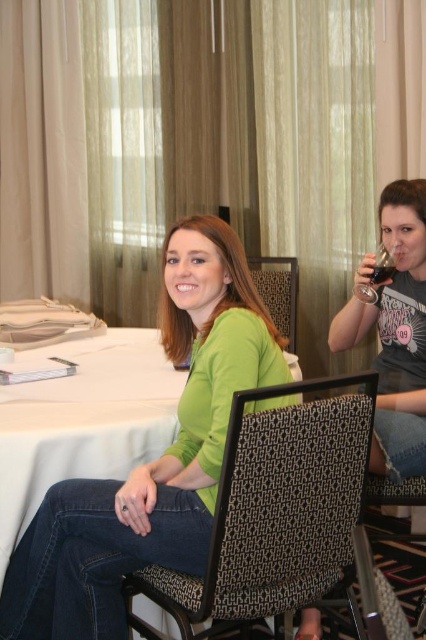
Question: Is brown textured fabric chair at center below translucent glass at upper right?

Choices:
 (A) yes
 (B) no

Answer: (A)

Question: Which object is the closest to the translucent glass at upper right?

Choices:
 (A) translucent glass wine glass at upper right
 (B) white fabric table at center

Answer: (A)

Question: Is black textured chair at center wider than translucent glass at upper right?

Choices:
 (A) yes
 (B) no

Answer: (A)

Question: Which point is farther from the camera taking this photo?

Choices:
 (A) (333, 321)
 (B) (0, 394)
 (C) (391, 264)

Answer: (A)

Question: Does matte black shirt at right appear under black textured chair at center?

Choices:
 (A) yes
 (B) no

Answer: (A)

Question: Which of these objects is positioned farthest from the matte black shirt at right?

Choices:
 (A) black textured chair at center
 (B) translucent glass at upper right

Answer: (A)